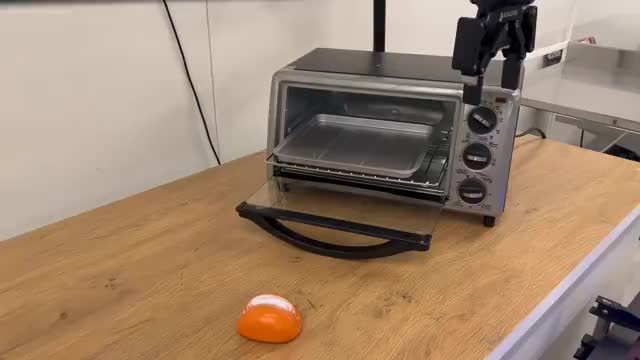
Where is `toaster oven`? toaster oven is located at coordinates (481, 119), (480, 150), (480, 189).